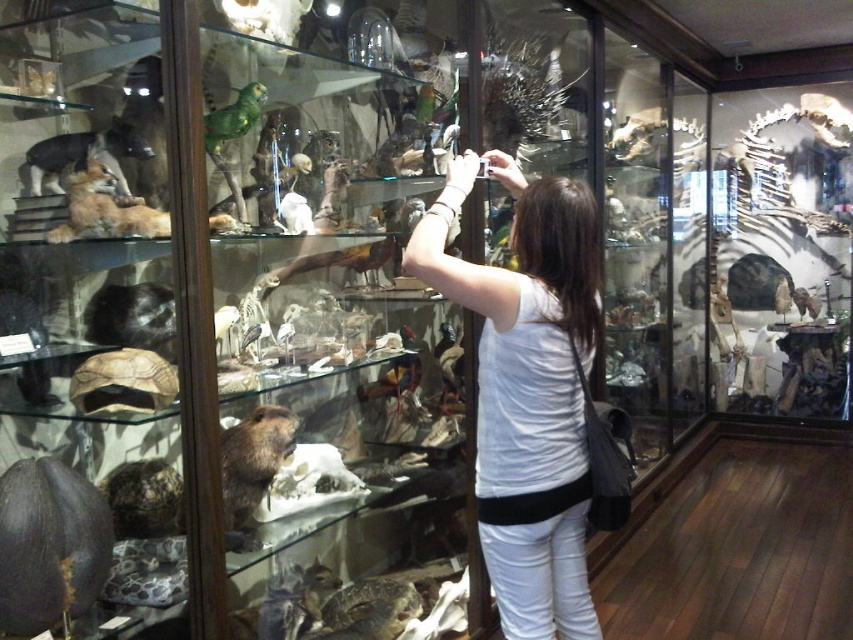
You are a visitor in the museum and want to take a photo of the brown furry beaver at lower left without the white cotton shirt at center appearing in the frame. Is this possible given their positions?

The white cotton shirt at center is positioned on the right side of brown furry beaver at lower left. Since the shirt is to the right of the beaver, you can aim your camera to the left side of the beaver to exclude the shirt from the frame.

You are a museum visitor holding a 10 cm wide book. You want to place it between the brown textured tortoise at lower left and the brown fur dog at left. Will it fit?

The brown textured tortoise at lower left is thinner than the brown fur dog at left, so the space between them is wider than 10 cm. The book will fit.

You are a visitor in the museum and want to take a clear photo of the brown textured tortoise at lower left without the brown fur dog at left blocking it. Is this possible given their positions?

The brown textured tortoise at lower left is in front of the brown fur dog at left, so the tortoise would block the view of the dog. Therefore, you can take a clear photo of the tortoise without the dog obstructing it.